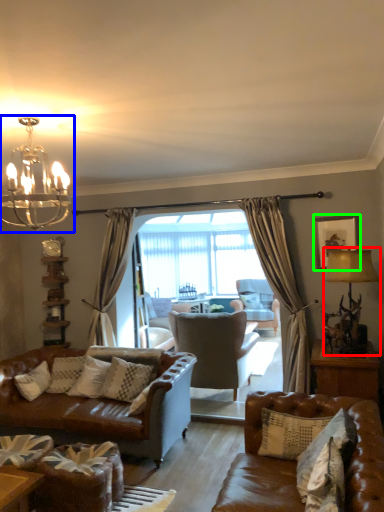
Question: Considering the real-world distances, which object is closest to lamp (highlighted by a red box)? light fixture (highlighted by a blue box) or picture frame (highlighted by a green box).

Choices:
 (A) light fixture
 (B) picture frame

Answer: (B)